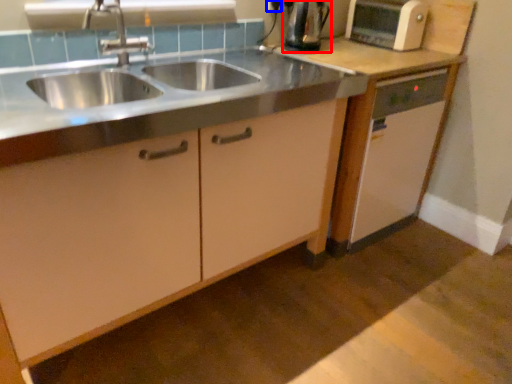
Question: Which object is closer to the camera taking this photo, kitchen appliance (highlighted by a red box) or electric outlet (highlighted by a blue box)?

Choices:
 (A) kitchen appliance
 (B) electric outlet

Answer: (A)